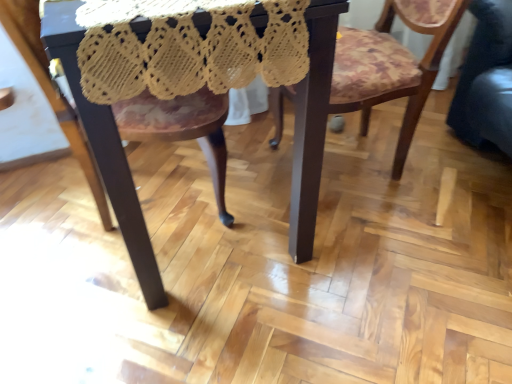
Where is `free space in front of dark brown polished wood table at center`? free space in front of dark brown polished wood table at center is located at coordinates (198, 323).